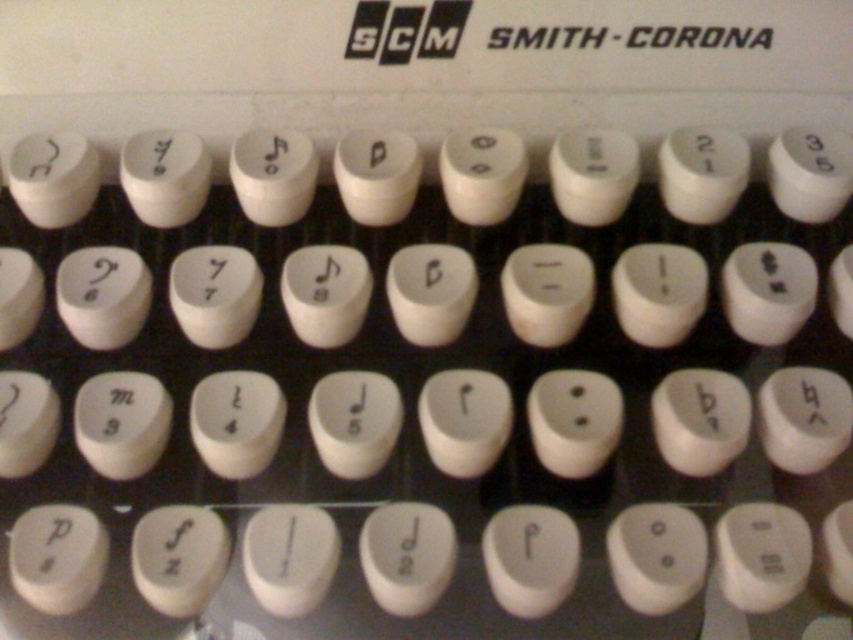
Does matte white key at upper left have a lesser width compared to white plastic key at center?

No.

Is point (26, 157) in front of point (166, 145)?

Yes.

Where is `matte white key at upper left`? Image resolution: width=853 pixels, height=640 pixels. matte white key at upper left is located at coordinates (39, 156).

Which is behind, point (579, 42) or point (53, 152)?

Positioned behind is point (579, 42).

Identify the location of black plastic text at upper center. This screenshot has height=640, width=853. (698, 36).

Who is taller, black plastic text at upper center or white plastic key at center?

white plastic key at center is taller.

Is point (672, 44) more distant than point (152, 148)?

That is True.

Find the location of a particular element. black plastic text at upper center is located at coordinates (698, 36).